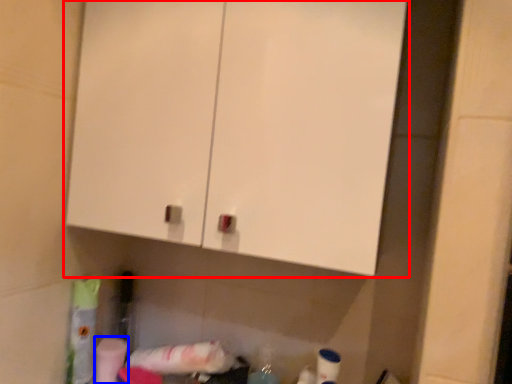
Question: Which of the following is the closest to the observer, cabinetry (highlighted by a red box) or toilet paper (highlighted by a blue box)?

Choices:
 (A) cabinetry
 (B) toilet paper

Answer: (A)